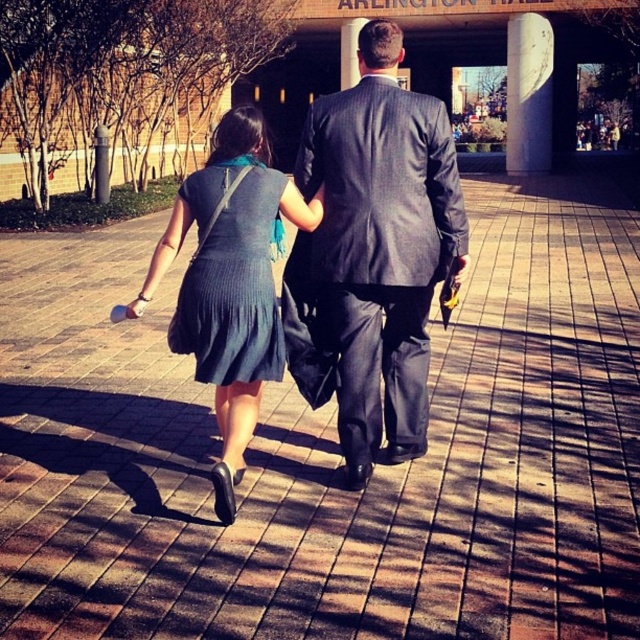
Is point (352, 323) positioned after point (280, 358)?

Yes, it is behind point (280, 358).

Does matte black dress at center appear on the left side of knit fabric dress at center-left?

In fact, matte black dress at center is to the right of knit fabric dress at center-left.

Describe the element at coordinates (372, 253) in the screenshot. This screenshot has width=640, height=640. I see `matte black dress at center` at that location.

The height and width of the screenshot is (640, 640). I want to click on matte black dress at center, so click(372, 253).

The width and height of the screenshot is (640, 640). What do you see at coordinates (230, 282) in the screenshot?
I see `knit fabric dress at center-left` at bounding box center [230, 282].

Can you confirm if knit fabric dress at center-left is positioned below white marble pillar at upper right?

Yes, knit fabric dress at center-left is below white marble pillar at upper right.

Between point (221, 426) and point (538, 108), which one is positioned behind?

Point (538, 108)

Find the location of a particular element. knit fabric dress at center-left is located at coordinates (230, 282).

Who is positioned more to the left, gray suit at center or knit fabric dress at center?

From the viewer's perspective, knit fabric dress at center appears more on the left side.

Where is `gray suit at center`? This screenshot has width=640, height=640. gray suit at center is located at coordinates (376, 246).

Is point (410, 252) positioned before point (257, 365)?

No, (410, 252) is further to viewer.

This screenshot has width=640, height=640. I want to click on gray suit at center, so click(376, 246).